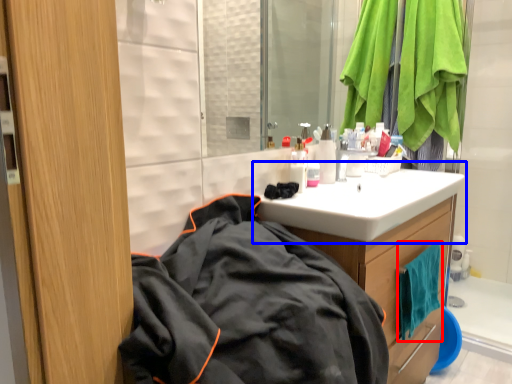
Question: Which point is further to the camera, beach towel (highlighted by a red box) or sink (highlighted by a blue box)?

Choices:
 (A) beach towel
 (B) sink

Answer: (A)